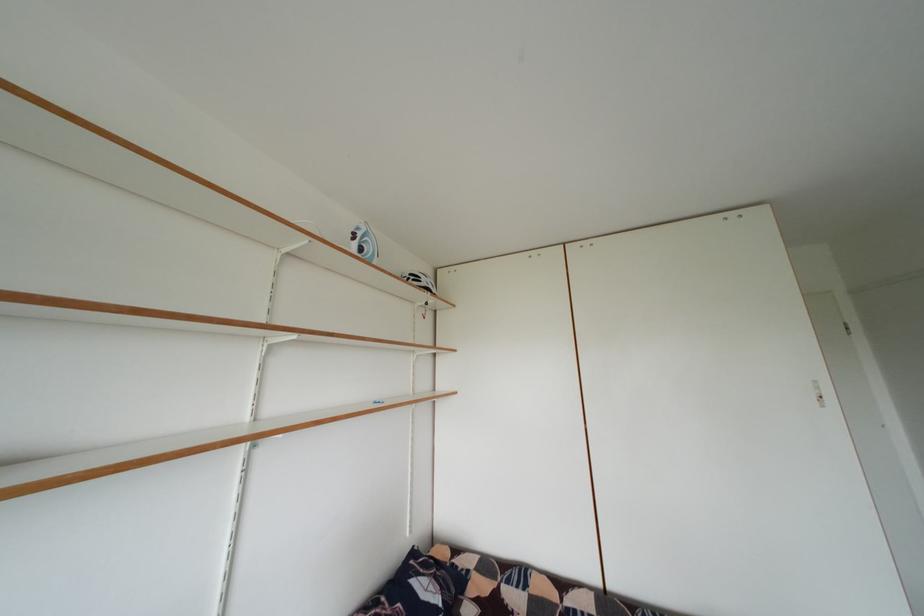
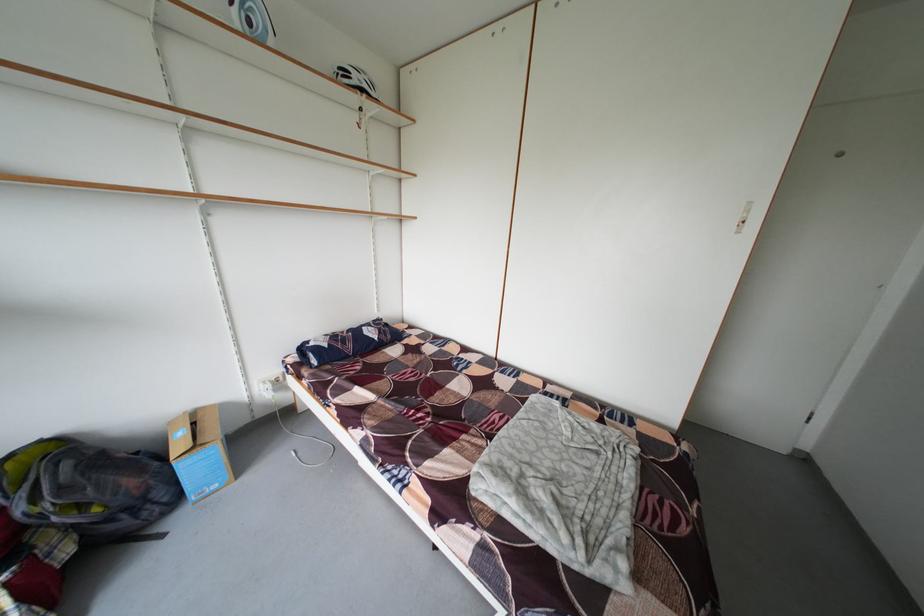
Locate, in the second image, the point that corresponds to point (441, 292) in the first image.

(375, 92)